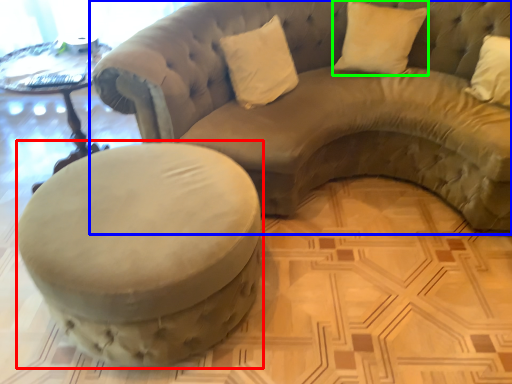
Question: Which object is the farthest from swivel chair (highlighted by a red box)? Choose among these: studio couch (highlighted by a blue box) or pillow (highlighted by a green box).

Choices:
 (A) studio couch
 (B) pillow

Answer: (B)